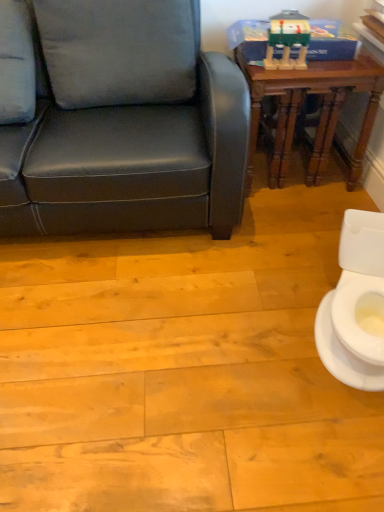
Where is `vacant space to the right of matte green plastic toy at upper right`? The width and height of the screenshot is (384, 512). vacant space to the right of matte green plastic toy at upper right is located at coordinates (325, 65).